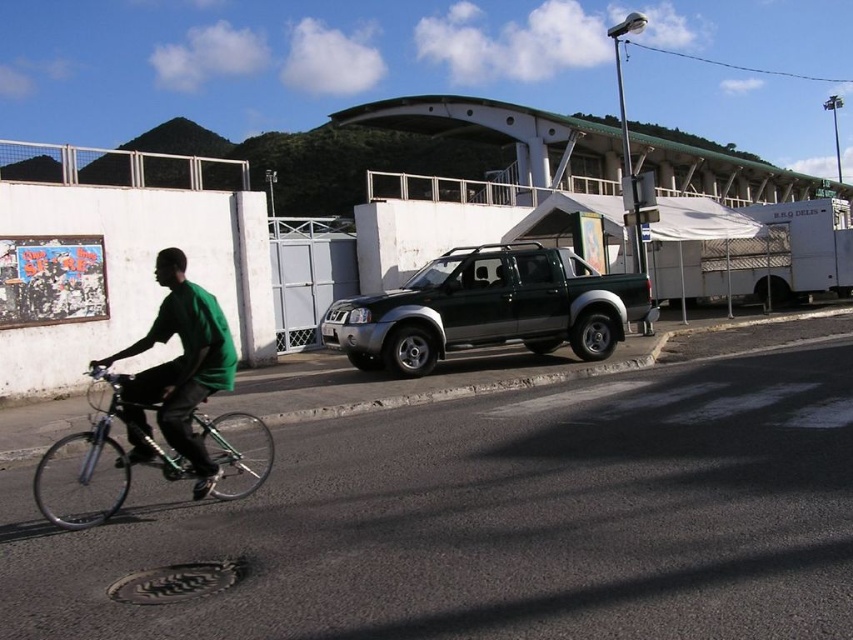
Question: Can you confirm if shiny metallic bicycle at lower left is wider than green matte shirt at left?

Choices:
 (A) no
 (B) yes

Answer: (B)

Question: Which object appears closest to the camera in this image?

Choices:
 (A) shiny metallic bicycle at lower left
 (B) green matte shirt at left
 (C) green matte truck at center

Answer: (A)

Question: Can you confirm if green matte truck at center is bigger than shiny metallic bicycle at lower left?

Choices:
 (A) no
 (B) yes

Answer: (A)

Question: Which point is farther from the camera taking this photo?

Choices:
 (A) (160, 340)
 (B) (68, 520)

Answer: (A)

Question: Estimate the real-world distances between objects in this image. Which object is closer to the green matte shirt at left?

Choices:
 (A) shiny metallic bicycle at lower left
 (B) green matte truck at center

Answer: (A)

Question: Is shiny metallic bicycle at lower left smaller than green matte shirt at left?

Choices:
 (A) no
 (B) yes

Answer: (A)